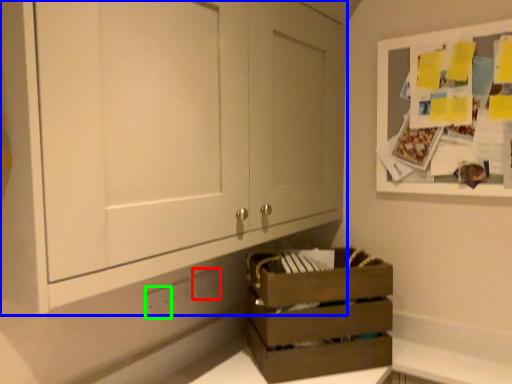
Question: Estimate the real-world distances between objects in this image. Which object is closer to electric outlet (highlighted by a red box), cabinetry (highlighted by a blue box) or electric outlet (highlighted by a green box)?

Choices:
 (A) cabinetry
 (B) electric outlet

Answer: (B)